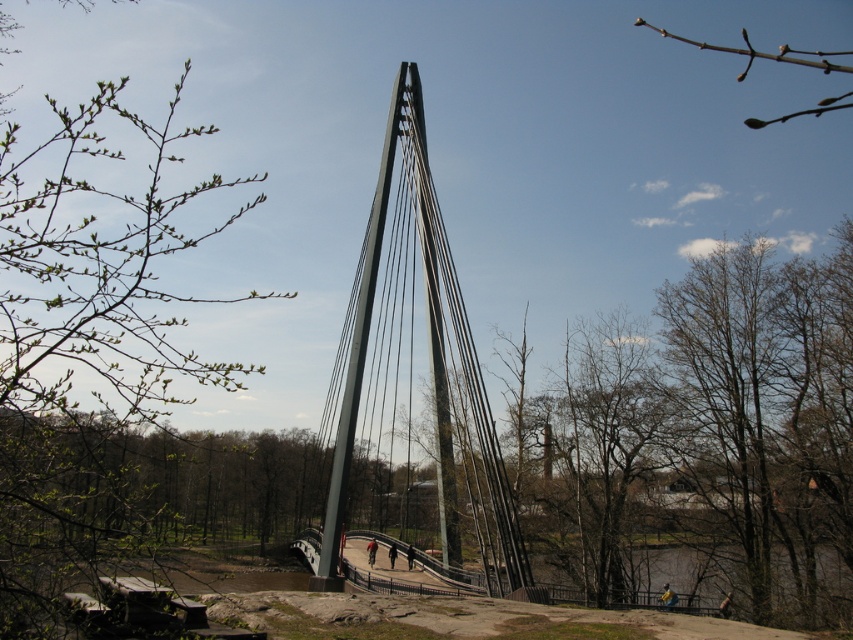
Locate an element on the screen. This screenshot has width=853, height=640. green leafy branch at upper left is located at coordinates (85, 346).

Does point (231, 180) come in front of point (358, 339)?

No.

Describe the element at coordinates (85, 346) in the screenshot. I see `green leafy branch at upper left` at that location.

Locate an element on the screen. Image resolution: width=853 pixels, height=640 pixels. green leafy branch at upper left is located at coordinates (85, 346).